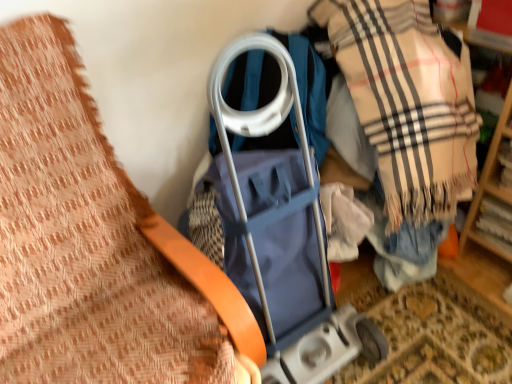
Question: From the image's perspective, would you say blue fabric baby carriage at center is shown under orange leather belt at upper left?

Choices:
 (A) no
 (B) yes

Answer: (A)

Question: Is blue fabric baby carriage at center further to the viewer compared to orange leather belt at upper left?

Choices:
 (A) no
 (B) yes

Answer: (B)

Question: Can you confirm if blue fabric baby carriage at center is positioned to the right of orange leather belt at upper left?

Choices:
 (A) no
 (B) yes

Answer: (B)

Question: Is blue fabric baby carriage at center closer to the viewer compared to orange leather belt at upper left?

Choices:
 (A) yes
 (B) no

Answer: (B)

Question: From a real-world perspective, is blue fabric baby carriage at center located beneath orange leather belt at upper left?

Choices:
 (A) no
 (B) yes

Answer: (B)

Question: Choose the correct answer: Is blue fabric baby carriage at center inside beige plaid scarf at center right or outside it?

Choices:
 (A) outside
 (B) inside

Answer: (A)

Question: Considering the positions of blue fabric baby carriage at center and beige plaid scarf at center right in the image, is blue fabric baby carriage at center wider or thinner than beige plaid scarf at center right?

Choices:
 (A) thin
 (B) wide

Answer: (B)

Question: In terms of height, does blue fabric baby carriage at center look taller or shorter compared to beige plaid scarf at center right?

Choices:
 (A) short
 (B) tall

Answer: (A)

Question: From the image's perspective, is blue fabric baby carriage at center positioned above or below beige plaid scarf at center right?

Choices:
 (A) below
 (B) above

Answer: (A)

Question: In the image, is beige plaid scarf at center right positioned in front of or behind orange leather belt at upper left?

Choices:
 (A) front
 (B) behind

Answer: (B)

Question: Is beige plaid scarf at center right bigger or smaller than orange leather belt at upper left?

Choices:
 (A) big
 (B) small

Answer: (B)

Question: Considering the relative positions of beige plaid scarf at center right and orange leather belt at upper left in the image provided, is beige plaid scarf at center right to the left or to the right of orange leather belt at upper left?

Choices:
 (A) left
 (B) right

Answer: (B)

Question: From a real-world perspective, is beige plaid scarf at center right physically located above or below orange leather belt at upper left?

Choices:
 (A) above
 (B) below

Answer: (A)

Question: Is point (99, 334) positioned closer to the camera than point (296, 127)?

Choices:
 (A) closer
 (B) farther

Answer: (A)

Question: In terms of height, does orange leather belt at upper left look taller or shorter compared to blue fabric baby carriage at center?

Choices:
 (A) short
 (B) tall

Answer: (B)